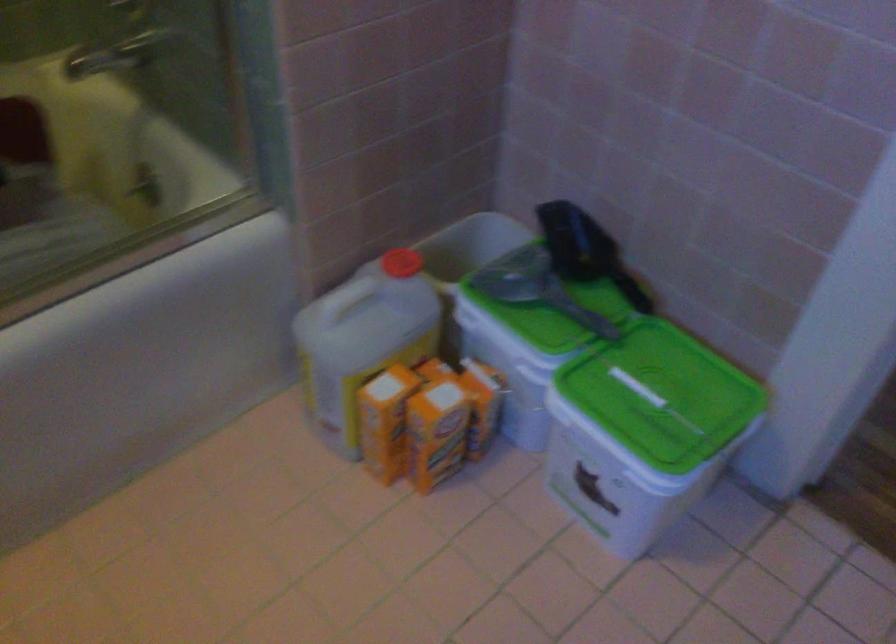
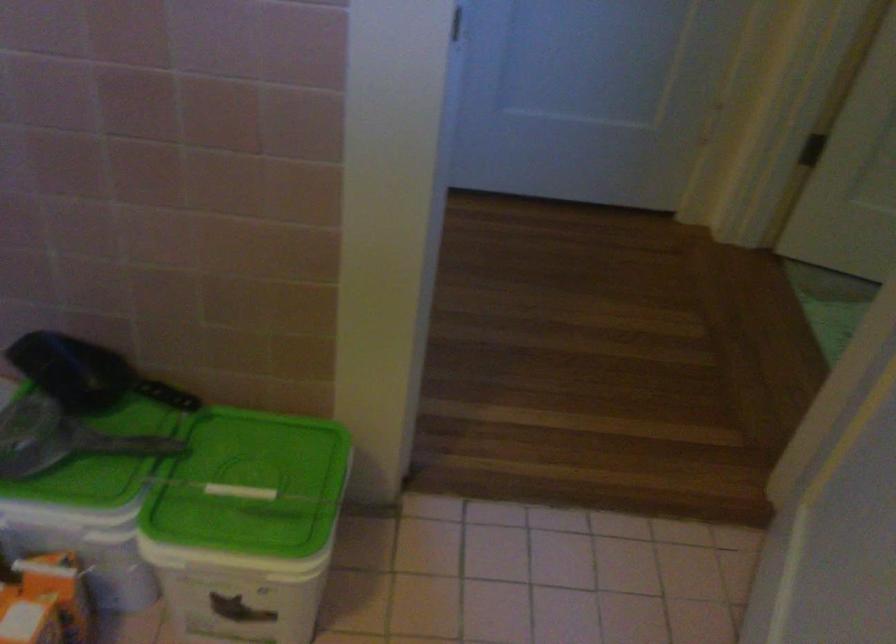
The point at [633,384] is marked in the first image. Where is the corresponding point in the second image?

(239, 491)